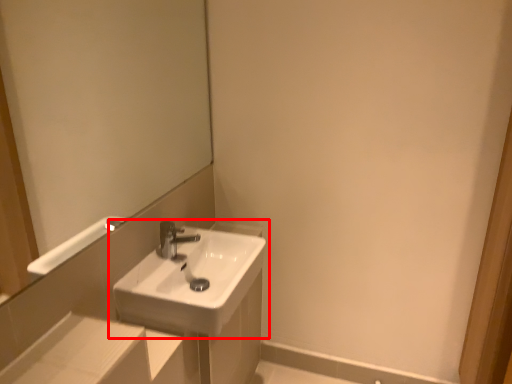
Question: From the image, what is the correct spatial relationship of sink (annotated by the red box) in relation to mirror?

Choices:
 (A) right
 (B) left

Answer: (A)